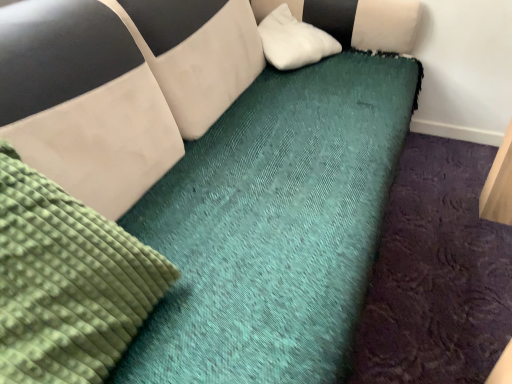
Question: Is white soft pillow at upper center located outside green textured mattress at upper left?

Choices:
 (A) yes
 (B) no

Answer: (A)

Question: From a real-world perspective, is white soft pillow at upper center on top of green textured mattress at upper left?

Choices:
 (A) no
 (B) yes

Answer: (A)

Question: Considering the relative sizes of white soft pillow at upper center and green textured mattress at upper left in the image provided, is white soft pillow at upper center bigger than green textured mattress at upper left?

Choices:
 (A) yes
 (B) no

Answer: (B)

Question: Does white soft pillow at upper center have a smaller size compared to green textured mattress at upper left?

Choices:
 (A) yes
 (B) no

Answer: (A)

Question: Considering the relative positions of white soft pillow at upper center and green textured mattress at upper left in the image provided, is white soft pillow at upper center to the right of green textured mattress at upper left from the viewer's perspective?

Choices:
 (A) yes
 (B) no

Answer: (A)

Question: Is white soft pillow at upper center turned away from green textured mattress at upper left?

Choices:
 (A) yes
 (B) no

Answer: (B)

Question: From the image's perspective, does green textured mattress at upper left appear lower than white soft pillow at upper center?

Choices:
 (A) yes
 (B) no

Answer: (A)

Question: Does green textured mattress at upper left touch white soft pillow at upper center?

Choices:
 (A) yes
 (B) no

Answer: (B)

Question: Are green textured mattress at upper left and white soft pillow at upper center far apart?

Choices:
 (A) no
 (B) yes

Answer: (B)

Question: Is green textured mattress at upper left surrounding white soft pillow at upper center?

Choices:
 (A) no
 (B) yes

Answer: (A)

Question: From a real-world perspective, does green textured mattress at upper left stand above white soft pillow at upper center?

Choices:
 (A) yes
 (B) no

Answer: (A)

Question: From the image's perspective, is green textured mattress at upper left above white soft pillow at upper center?

Choices:
 (A) yes
 (B) no

Answer: (B)

Question: From a real-world perspective, is white soft pillow at upper center physically located above or below green textured mattress at upper left?

Choices:
 (A) above
 (B) below

Answer: (B)